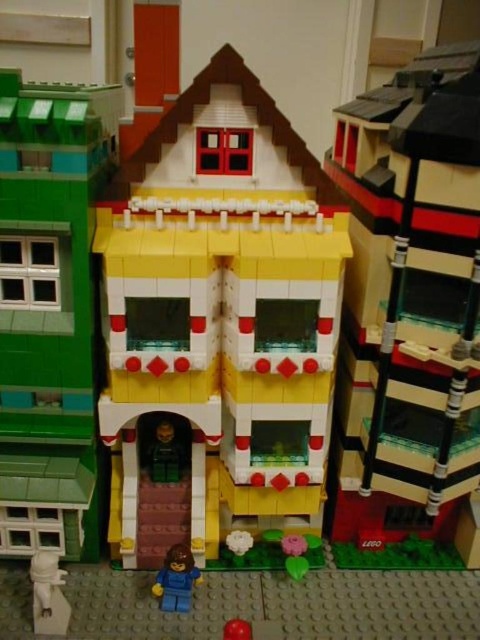
You are a visitor at a Lego exhibition and want to take a photo of both the white plastic minifigure at lower left and the blue plastic minifigure at lower center. Which minifigure should you focus on first to ensure both are in the frame?

You should focus on the white plastic minifigure at lower left first because it is closer to the viewer than the blue plastic minifigure at lower center, ensuring both are in the frame when adjusting the camera angle.

You are holding a smooth red ball at lower center and want to place it inside the translucent plastic window at center. Based on their sizes, will the ball fit through the window?

The translucent plastic window at center has a width larger than the smooth red ball at lower center, so the ball can fit through the window.

You are a Lego builder examining the scene. You notice a point at coordinates (176, 579). Which object from the list contains this point? Choose from the objects listed in the scene description.

The point at coordinates (176, 579) is on the blue plastic minifigure at lower center.